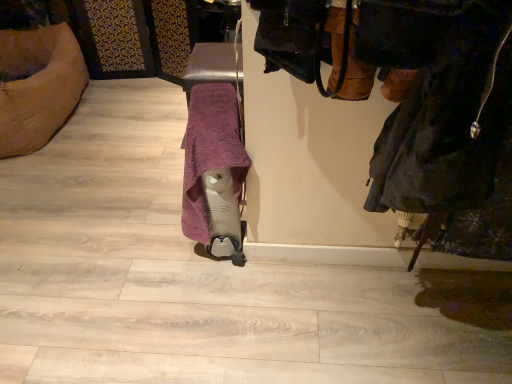
Question: Does dark gray fabric coat at right lie behind purple soft towel at center?

Choices:
 (A) no
 (B) yes

Answer: (A)

Question: Is dark gray fabric coat at right looking in the opposite direction of purple soft towel at center?

Choices:
 (A) yes
 (B) no

Answer: (B)

Question: Is dark gray fabric coat at right at the right side of purple soft towel at center?

Choices:
 (A) no
 (B) yes

Answer: (B)

Question: Is purple soft towel at center surrounded by dark gray fabric coat at right?

Choices:
 (A) yes
 (B) no

Answer: (B)

Question: Can you confirm if dark gray fabric coat at right is smaller than purple soft towel at center?

Choices:
 (A) yes
 (B) no

Answer: (A)

Question: Does dark gray fabric coat at right appear on the left side of purple soft towel at center?

Choices:
 (A) no
 (B) yes

Answer: (A)

Question: Does purple soft towel at center have a smaller size compared to dark gray fabric coat at right?

Choices:
 (A) no
 (B) yes

Answer: (A)

Question: Considering the relative sizes of purple soft towel at center and dark gray fabric coat at right in the image provided, is purple soft towel at center taller than dark gray fabric coat at right?

Choices:
 (A) yes
 (B) no

Answer: (A)

Question: From the image's perspective, is purple soft towel at center located beneath dark gray fabric coat at right?

Choices:
 (A) yes
 (B) no

Answer: (A)

Question: Is purple soft towel at center at the right side of dark gray fabric coat at right?

Choices:
 (A) no
 (B) yes

Answer: (A)

Question: Would you say dark gray fabric coat at right is part of purple soft towel at center's contents?

Choices:
 (A) yes
 (B) no

Answer: (B)

Question: Is purple soft towel at center wider than dark gray fabric coat at right?

Choices:
 (A) yes
 (B) no

Answer: (B)

Question: Visually, is purple soft towel at center positioned to the left or to the right of dark gray fabric coat at right?

Choices:
 (A) right
 (B) left

Answer: (B)